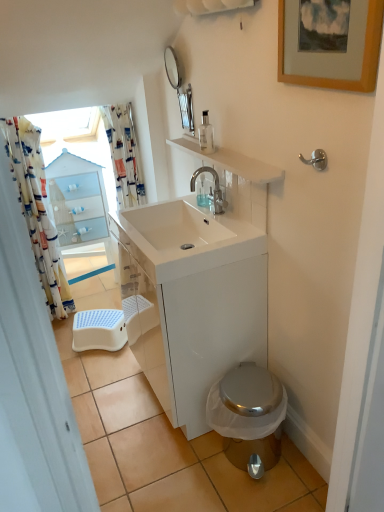
Question: Is polished chrome faucet at upper center looking in the opposite direction of blue plastic step stool at lower left?

Choices:
 (A) yes
 (B) no

Answer: (B)

Question: Considering the relative sizes of polished chrome faucet at upper center and blue plastic step stool at lower left in the image provided, is polished chrome faucet at upper center taller than blue plastic step stool at lower left?

Choices:
 (A) no
 (B) yes

Answer: (B)

Question: Is blue plastic step stool at lower left a part of polished chrome faucet at upper center?

Choices:
 (A) no
 (B) yes

Answer: (A)

Question: Does polished chrome faucet at upper center turn towards blue plastic step stool at lower left?

Choices:
 (A) no
 (B) yes

Answer: (A)

Question: Is polished chrome faucet at upper center positioned far away from blue plastic step stool at lower left?

Choices:
 (A) no
 (B) yes

Answer: (B)

Question: Can you confirm if polished chrome faucet at upper center is positioned to the right of blue plastic step stool at lower left?

Choices:
 (A) yes
 (B) no

Answer: (A)

Question: Considering the relative positions of satin nickel hook at upper right and printed fabric shower curtain at upper left, positioned as the 2th shower curtain in left-to-right order, in the image provided, is satin nickel hook at upper right to the right of printed fabric shower curtain at upper left, positioned as the 2th shower curtain in left-to-right order, from the viewer's perspective?

Choices:
 (A) yes
 (B) no

Answer: (A)

Question: Is satin nickel hook at upper right far away from printed fabric shower curtain at upper left, the first shower curtain from the right?

Choices:
 (A) no
 (B) yes

Answer: (B)

Question: Is satin nickel hook at upper right turned away from printed fabric shower curtain at upper left, the first shower curtain from the right?

Choices:
 (A) no
 (B) yes

Answer: (A)

Question: Could you tell me if satin nickel hook at upper right is facing printed fabric shower curtain at upper left, the first shower curtain from the right?

Choices:
 (A) no
 (B) yes

Answer: (A)

Question: Is satin nickel hook at upper right at the left side of printed fabric shower curtain at upper left, the first shower curtain from the right?

Choices:
 (A) yes
 (B) no

Answer: (B)

Question: From a real-world perspective, is satin nickel hook at upper right beneath printed fabric shower curtain at upper left, positioned as the 2th shower curtain in left-to-right order?

Choices:
 (A) yes
 (B) no

Answer: (B)

Question: Is wooden picture frame at upper right bigger than printed fabric shower curtain at upper left, positioned as the 2th shower curtain in left-to-right order?

Choices:
 (A) yes
 (B) no

Answer: (B)